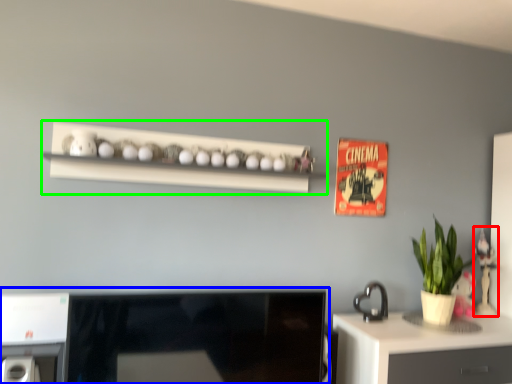
Question: Which is nearer to the toy (highlighted by a red box)? desktop (highlighted by a blue box) or shelf (highlighted by a green box).

Choices:
 (A) desktop
 (B) shelf

Answer: (B)